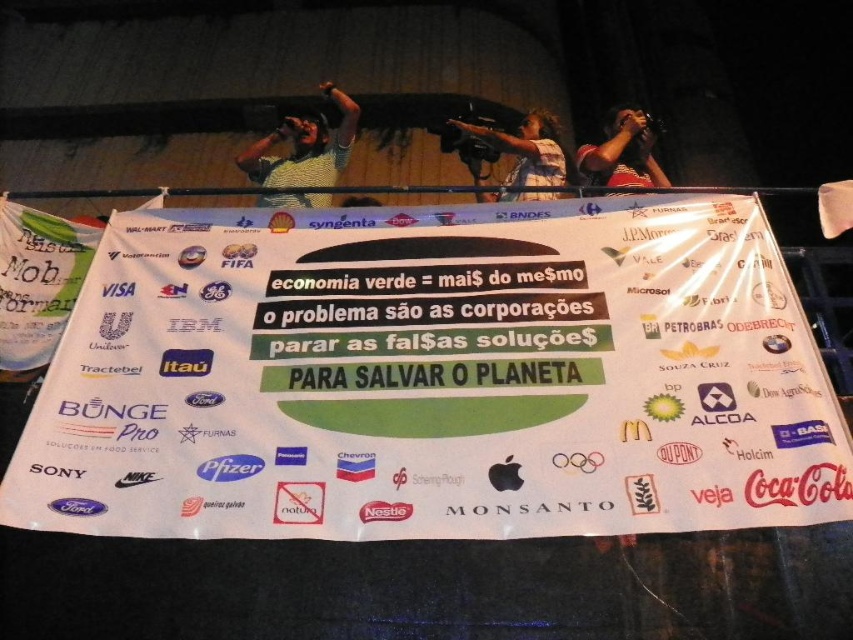
Question: Can you confirm if white paper banner at center is positioned to the right of striped shirt at upper center?

Choices:
 (A) yes
 (B) no

Answer: (B)

Question: Which object is closer to the camera taking this photo?

Choices:
 (A) yellow-green knit sweater at upper center
 (B) white paper banner at center
 (C) blue denim shirt at upper center
 (D) striped shirt at upper center

Answer: (B)

Question: Among these points, which one is nearest to the camera?

Choices:
 (A) (328, 172)
 (B) (553, 131)
 (C) (573, 208)

Answer: (C)

Question: Can you confirm if white paper banner at center is bigger than striped shirt at upper center?

Choices:
 (A) no
 (B) yes

Answer: (B)

Question: Observing the image, what is the correct spatial positioning of white paper banner at center in reference to blue denim shirt at upper center?

Choices:
 (A) above
 (B) below

Answer: (B)

Question: Among these points, which one is nearest to the camera?

Choices:
 (A) (276, 164)
 (B) (485, 140)

Answer: (B)